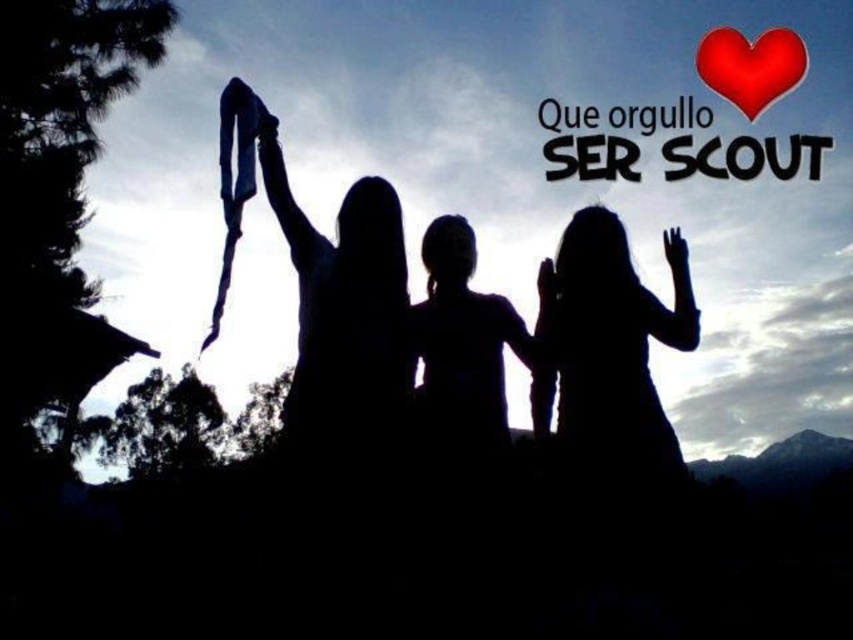
Who is more forward, (596, 403) or (798, 36)?

Positioned in front is point (596, 403).

Identify the location of silhouette dress at center. [608, 348].

Locate an element on the screen. This screenshot has height=640, width=853. silhouette hair at center is located at coordinates (469, 346).

Is silhouette hair at center smaller than red matte heart at upper right?

Actually, silhouette hair at center might be larger than red matte heart at upper right.

Is point (495, 352) closer to viewer compared to point (780, 51)?

That is True.

Where is `silhouette hair at center`? This screenshot has height=640, width=853. silhouette hair at center is located at coordinates (469, 346).

This screenshot has width=853, height=640. What do you see at coordinates (608, 348) in the screenshot? I see `silhouette dress at center` at bounding box center [608, 348].

Does point (631, 328) come in front of point (506, 333)?

That is True.

Image resolution: width=853 pixels, height=640 pixels. Identify the location of silhouette dress at center. tap(608, 348).